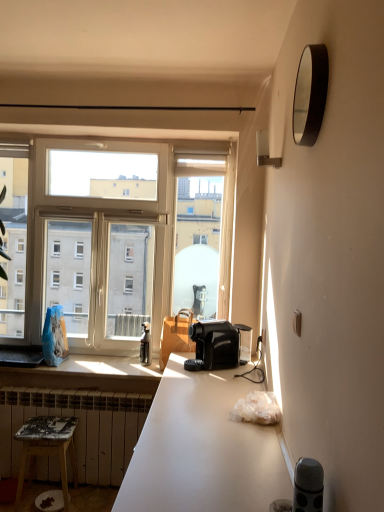
Question: From a real-world perspective, is white painted metal radiator at lower left beneath clear glass window at center?

Choices:
 (A) no
 (B) yes

Answer: (B)

Question: Is white painted metal radiator at lower left next to clear glass window at center?

Choices:
 (A) no
 (B) yes

Answer: (A)

Question: Could you tell me if white painted metal radiator at lower left is facing clear glass window at center?

Choices:
 (A) yes
 (B) no

Answer: (B)

Question: Can we say white painted metal radiator at lower left lies outside clear glass window at center?

Choices:
 (A) yes
 (B) no

Answer: (A)

Question: Is white painted metal radiator at lower left closer to the viewer compared to clear glass window at center?

Choices:
 (A) no
 (B) yes

Answer: (B)

Question: Looking at their shapes, would you say clear glass window at center is wider or thinner than wooden stool at lower left?

Choices:
 (A) wide
 (B) thin

Answer: (B)

Question: Is clear glass window at center inside or outside of wooden stool at lower left?

Choices:
 (A) outside
 (B) inside

Answer: (A)

Question: Is point (221, 275) positioned closer to the camera than point (72, 443)?

Choices:
 (A) farther
 (B) closer

Answer: (A)

Question: From the image's perspective, is clear glass window at center located above or below wooden stool at lower left?

Choices:
 (A) below
 (B) above

Answer: (B)

Question: Is clear glass window at center to the left or to the right of black plastic coffee machine at center in the image?

Choices:
 (A) right
 (B) left

Answer: (B)

Question: From a real-world perspective, relative to black plastic coffee machine at center, is clear glass window at center vertically above or below?

Choices:
 (A) below
 (B) above

Answer: (B)

Question: From the image's perspective, is clear glass window at center located above or below black plastic coffee machine at center?

Choices:
 (A) above
 (B) below

Answer: (A)

Question: Considering their positions, is clear glass window at center located in front of or behind black plastic coffee machine at center?

Choices:
 (A) front
 (B) behind

Answer: (B)

Question: Is point (317, 44) closer or farther from the camera than point (225, 326)?

Choices:
 (A) farther
 (B) closer

Answer: (B)

Question: In terms of width, does black glossy mirror at upper right look wider or thinner when compared to black plastic coffee machine at center?

Choices:
 (A) wide
 (B) thin

Answer: (B)